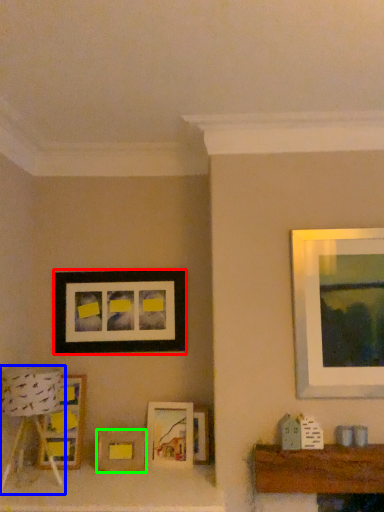
Question: Which object is positioned farthest from picture frame (highlighted by a red box)? Select from lamp (highlighted by a blue box) and picture frame (highlighted by a green box).

Choices:
 (A) lamp
 (B) picture frame

Answer: (B)